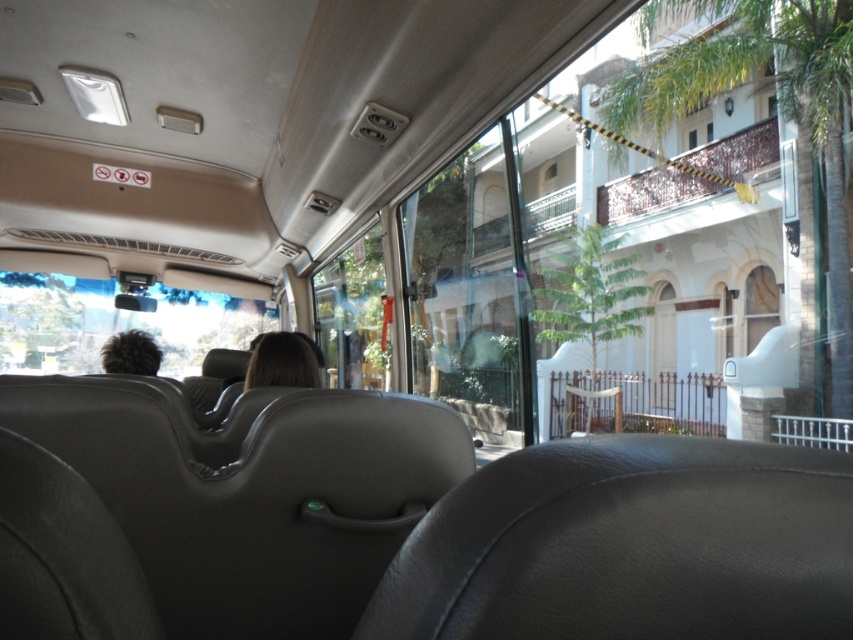
You are a bus passenger seated at the back and want to reach the front. The bus has a standing area between the brown hair at center and dark brown hair at left. Can you walk through the space between them?

The distance between brown hair at center and dark brown hair at left is 38.30 inches, which is approximately 3.19 feet. Since the standing area is narrow, it might be challenging to walk through comfortably, but physically possible if you move carefully.

In the scene shown: You are a passenger sitting in the front seat of the bus. You notice the transparent plastic window at upper left and the dark brown hair at left. Which object takes up more space in your view?

A: The transparent plastic window at upper left takes up more space in your view because it is bigger than the dark brown hair at left.

Consider the image. You are a passenger sitting at the front of the bus and want to reach a destination located at point (149, 342). There is an obstacle at point (279, 380). Will you encounter this obstacle before reaching your destination?

Point (279, 380) is in front of point (149, 342), so yes, you will encounter the obstacle at point (279, 380) before reaching your destination at point (149, 342).